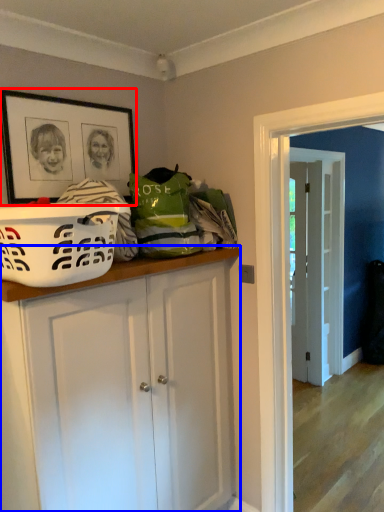
Question: Among these objects, which one is farthest to the camera, picture frame (highlighted by a red box) or cabinetry (highlighted by a blue box)?

Choices:
 (A) picture frame
 (B) cabinetry

Answer: (A)